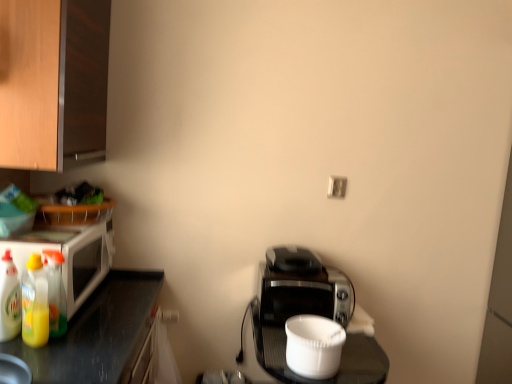
Question: Considering the relative positions of white glossy microwave at left and white plastic container at center, which ranks as the 2th appliance in back-to-front order, in the image provided, is white glossy microwave at left to the left or to the right of white plastic container at center, which ranks as the 2th appliance in back-to-front order,?

Choices:
 (A) left
 (B) right

Answer: (A)

Question: Considering the positions of point (83, 284) and point (335, 344), is point (83, 284) closer or farther from the camera than point (335, 344)?

Choices:
 (A) farther
 (B) closer

Answer: (A)

Question: Which is nearer to the white glossy microwave at left?

Choices:
 (A) translucent plastic bottles at left, the 1th bottle when ordered from right to left
 (B) wooden cabinet at upper left
 (C) black plastic toaster at center, the second appliance when ordered from front to back
 (D) yellow translucent bottle at left, which is counted as the 2th bottle, starting from the right
 (E) translucent plastic bottle at left, marked as the first bottle in a left-to-right arrangement

Answer: (A)

Question: Which of these objects is positioned farthest from the white plastic container at center, which ranks as the 2th appliance in back-to-front order?

Choices:
 (A) black plastic toaster at center, the second appliance when ordered from front to back
 (B) white plastic electric outlet at upper center
 (C) white glossy microwave at left
 (D) yellow translucent bottle at left, which is counted as the 2th bottle, starting from the right
 (E) translucent plastic bottles at left, the 3th bottle from the left

Answer: (D)